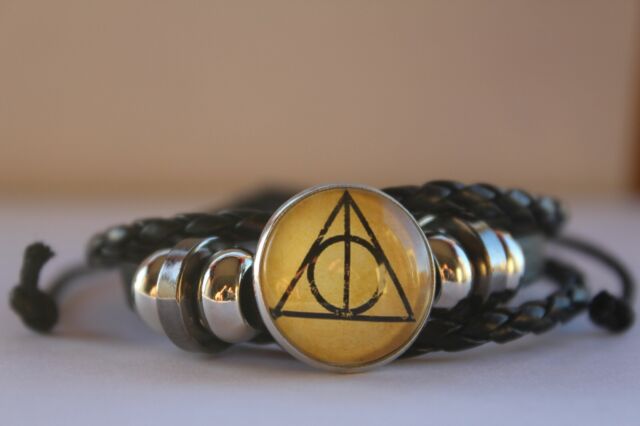
The height and width of the screenshot is (426, 640). Identify the location of wall. (337, 116).